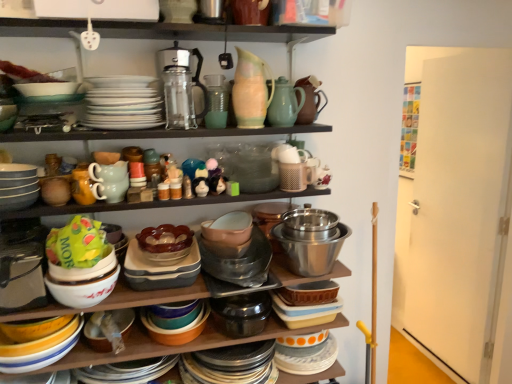
Question: Is brown matte teapot at upper center, the first tea pot positioned from the right, outside of transparent glass teapot at center, the 1th tea pot viewed from the left?

Choices:
 (A) yes
 (B) no

Answer: (A)

Question: From a real-world perspective, is brown matte teapot at upper center, marked as the third tea pot in a left-to-right arrangement, below transparent glass teapot at center, acting as the third tea pot starting from the right?

Choices:
 (A) yes
 (B) no

Answer: (A)

Question: Considering the relative positions of brown matte teapot at upper center, marked as the third tea pot in a left-to-right arrangement, and transparent glass teapot at center, acting as the third tea pot starting from the right, in the image provided, is brown matte teapot at upper center, marked as the third tea pot in a left-to-right arrangement, to the left of transparent glass teapot at center, acting as the third tea pot starting from the right, from the viewer's perspective?

Choices:
 (A) no
 (B) yes

Answer: (A)

Question: Are brown matte teapot at upper center, marked as the third tea pot in a left-to-right arrangement, and transparent glass teapot at center, acting as the third tea pot starting from the right, beside each other?

Choices:
 (A) no
 (B) yes

Answer: (A)

Question: Is brown matte teapot at upper center, marked as the third tea pot in a left-to-right arrangement, positioned with its back to transparent glass teapot at center, the 1th tea pot viewed from the left?

Choices:
 (A) yes
 (B) no

Answer: (B)

Question: Is translucent amber bowl at center, placed as the second bowl when sorted from left to right, wider or thinner than green matte bag at center?

Choices:
 (A) wide
 (B) thin

Answer: (A)

Question: In the image, is translucent amber bowl at center, marked as the 2th bowl in a right-to-left arrangement, on the left side or the right side of green matte bag at center?

Choices:
 (A) left
 (B) right

Answer: (B)

Question: Relative to green matte bag at center, is translucent amber bowl at center, marked as the 2th bowl in a right-to-left arrangement, in front or behind?

Choices:
 (A) behind
 (B) front

Answer: (A)

Question: From a real-world perspective, is translucent amber bowl at center, marked as the 2th bowl in a right-to-left arrangement, positioned above or below green matte bag at center?

Choices:
 (A) above
 (B) below

Answer: (B)

Question: Looking at the image, does brown matte teapot at upper center, marked as the third tea pot in a left-to-right arrangement, seem bigger or smaller compared to shiny metallic bowls at center, marked as the 3th bowl in a left-to-right arrangement?

Choices:
 (A) big
 (B) small

Answer: (B)

Question: From a real-world perspective, is brown matte teapot at upper center, the first tea pot positioned from the right, physically located above or below shiny metallic bowls at center, which ranks as the first bowl in right-to-left order?

Choices:
 (A) above
 (B) below

Answer: (A)

Question: Considering their positions, is brown matte teapot at upper center, marked as the third tea pot in a left-to-right arrangement, located in front of or behind shiny metallic bowls at center, which ranks as the first bowl in right-to-left order?

Choices:
 (A) behind
 (B) front

Answer: (A)

Question: Is brown matte teapot at upper center, marked as the third tea pot in a left-to-right arrangement, situated inside shiny metallic bowls at center, marked as the 3th bowl in a left-to-right arrangement, or outside?

Choices:
 (A) outside
 (B) inside

Answer: (A)

Question: Visually, is matte plastic containers at center positioned to the left or to the right of white glazed platter at center, which is the 2th platter from top to bottom?

Choices:
 (A) left
 (B) right

Answer: (B)

Question: Is point 264,258 closer or farther from the camera than point 53,339?

Choices:
 (A) farther
 (B) closer

Answer: (A)